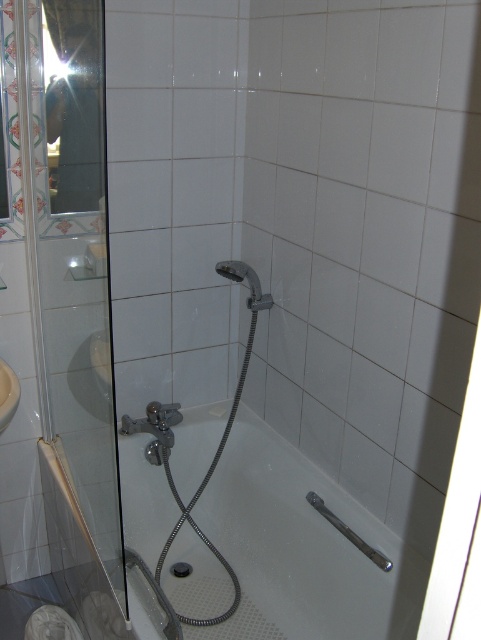
Based on the photo, you are a painter who needs to know the height of the transparent glass door at left and the white glossy bathtub at center. Which one is taller?

The transparent glass door at left is much taller than the white glossy bathtub at center.

You are a bathroom designer planning to install a new shelf between the transparent glass door at left and the white glossy bathtub at center. Based on their positions, where should the shelf be placed?

The transparent glass door at left is located above the white glossy bathtub at center, so the shelf should be placed between them by positioning it either above the bathtub but below the door or below the door but above the bathtub, ensuring it fits within the vertical space between these two objects.